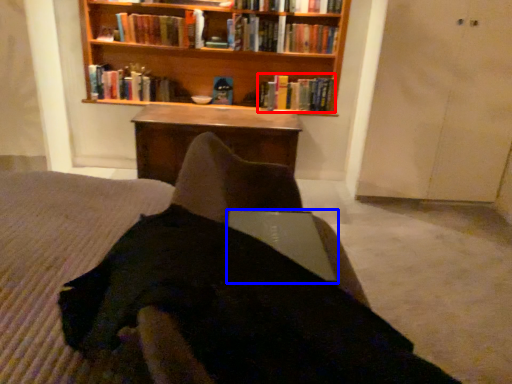
Question: Among these objects, which one is nearest to the camera, book (highlighted by a red box) or laptop (highlighted by a blue box)?

Choices:
 (A) book
 (B) laptop

Answer: (B)